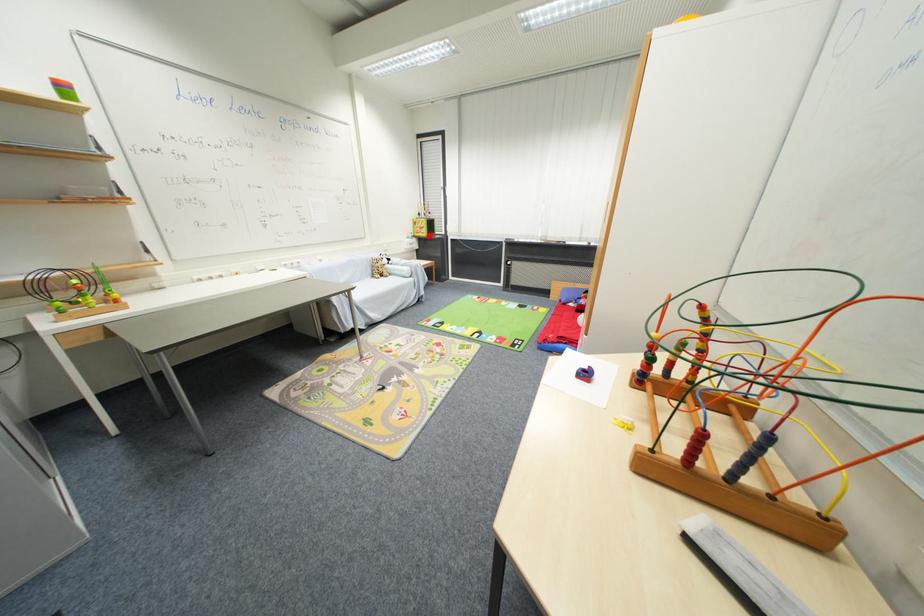
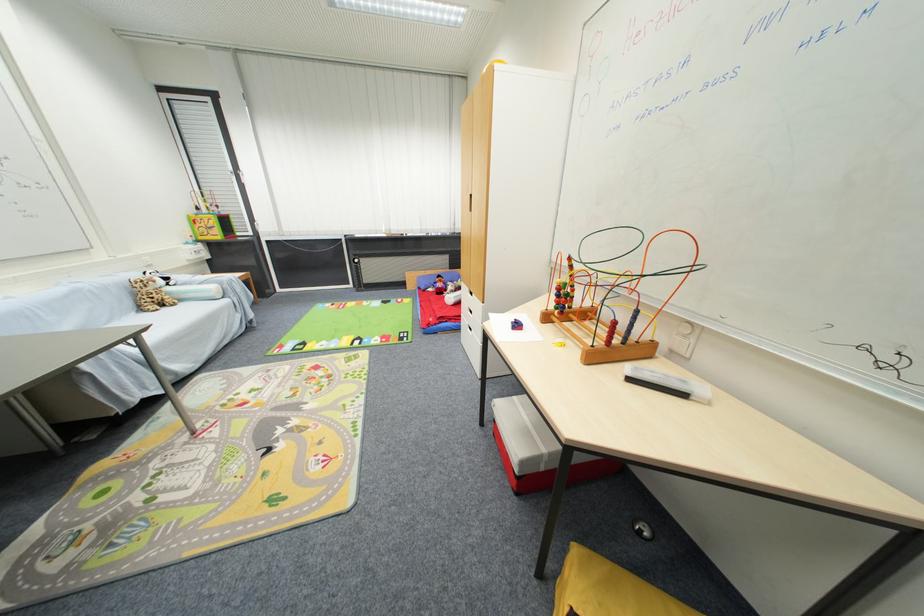
Locate, in the second image, the point that corresponds to the highlighted location in the first image.

(223, 238)